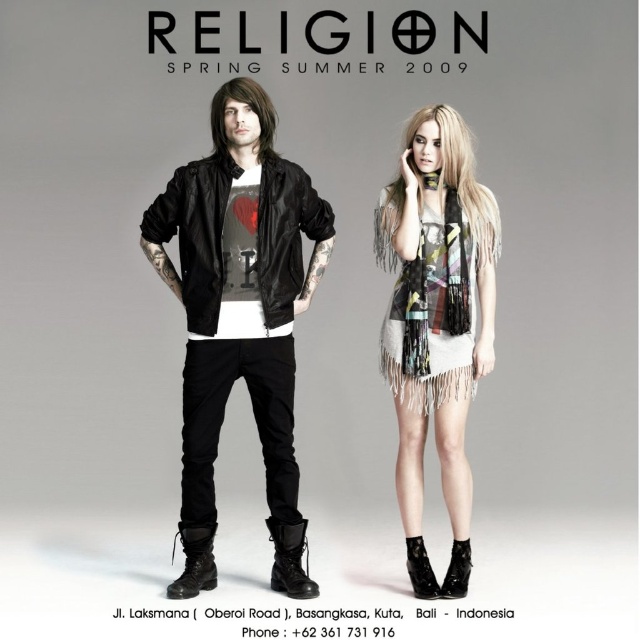
You are standing 10 feet away from the image. Can you reach the point at coordinates point [392,234] without moving closer?

The point at coordinates point [392,234] is only 9.50 feet away from the viewer. Since you are standing 10 feet away from the image, you are too far to reach it without moving closer.

You are a fashion designer trying to decide which piece to feature in your new collection. Based on the image, which item is taller between the matte black bomber jacket at center and the printed chiffon dress at center?

The matte black bomber jacket at center is much taller than the printed chiffon dress at center, so it would be the taller item to feature.

You are a fashion designer who wants to place a new accessory between the matte black bomber jacket at center and the fringed scarf at center in the image. The accessory is 10 inches wide. Can the accessory fit between them without overlapping either item?

The matte black bomber jacket at center and fringed scarf at center are 22.85 inches apart. Since the accessory is only 10 inches wide, there is enough space between them to place it without overlapping either item.